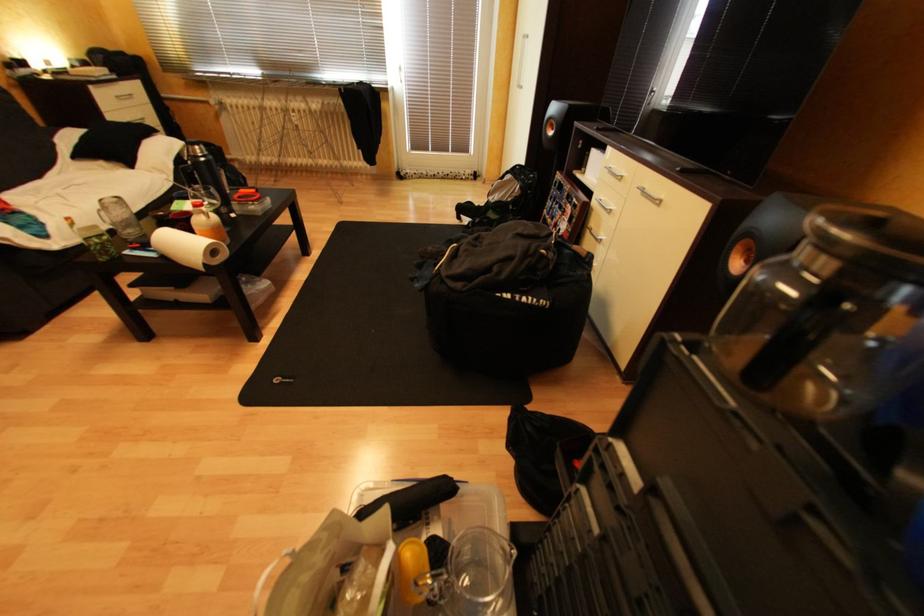
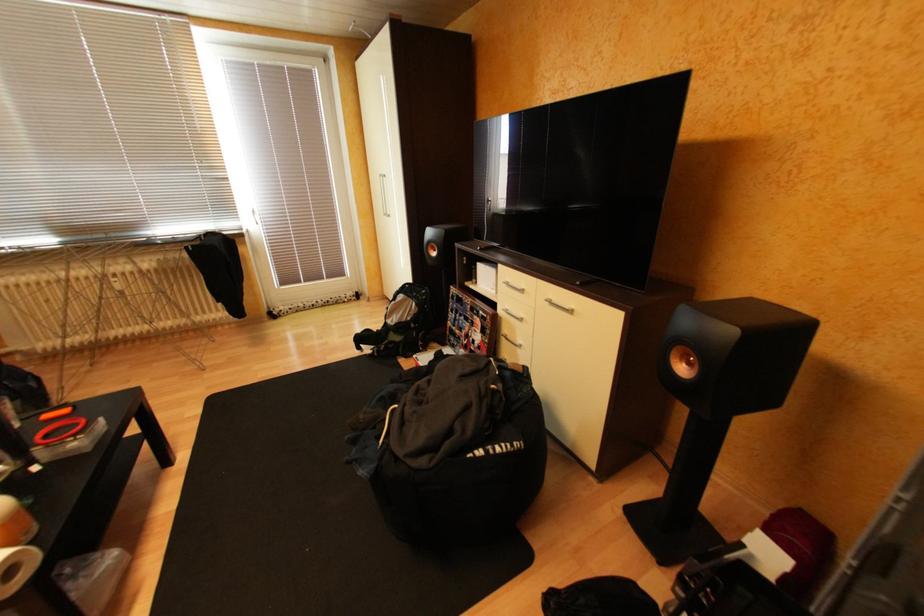
Question: The images are taken continuously from a first-person perspective. In which direction is your viewpoint rotating?

Choices:
 (A) Left
 (B) Right
 (C) Up
 (D) Down

Answer: (B)